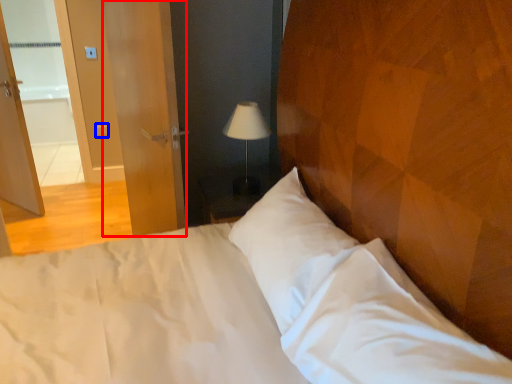
Question: Which object is further to the camera taking this photo, screen door (highlighted by a red box) or light switch (highlighted by a blue box)?

Choices:
 (A) screen door
 (B) light switch

Answer: (B)